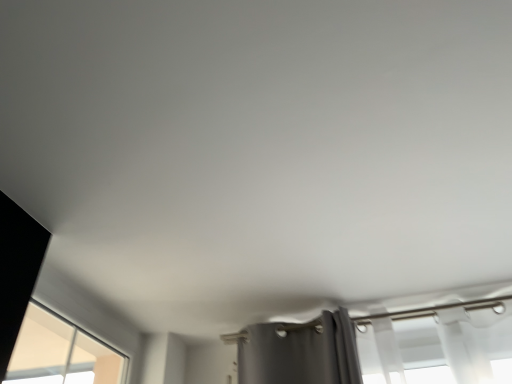
The height and width of the screenshot is (384, 512). What do you see at coordinates (61, 354) in the screenshot?
I see `transparent glass window at lower left` at bounding box center [61, 354].

What is the approximate height of transparent glass window at lower left?

15.12 inches.

Based on the photo, measure the distance between point (48, 329) and camera.

Point (48, 329) is 6.49 feet from camera.

Locate an element on the screen. The width and height of the screenshot is (512, 384). transparent glass window at lower left is located at coordinates (61, 354).

What is the approximate width of transparent glass window at lower left?

2.28 inches.

Image resolution: width=512 pixels, height=384 pixels. Identify the location of transparent glass window at lower left. (61, 354).